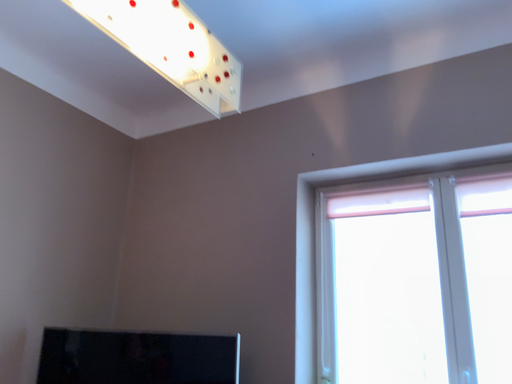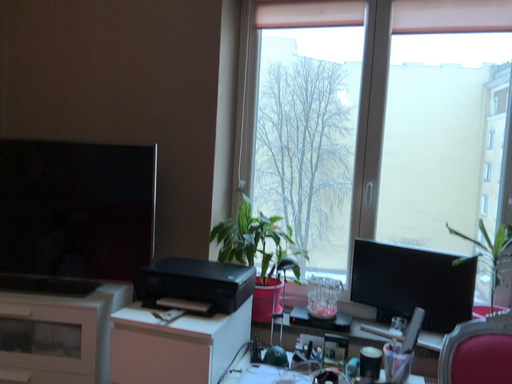
Question: How did the camera likely rotate when shooting the video?

Choices:
 (A) rotated upward
 (B) rotated downward

Answer: (B)